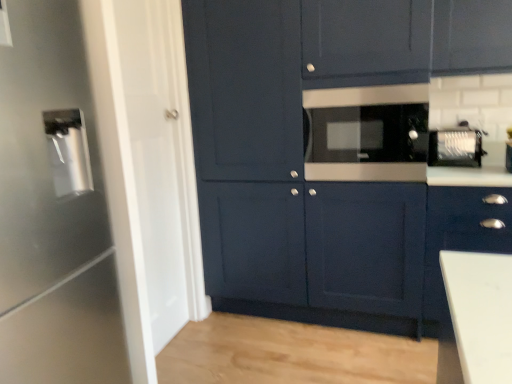
Question: Is satin black microwave at center, the second appliance when ordered from left to right, taller or shorter than satin silver toaster at upper right, the first appliance viewed from the back?

Choices:
 (A) short
 (B) tall

Answer: (B)

Question: From the image's perspective, is satin black microwave at center, the second appliance when ordered from right to left, located above or below satin silver toaster at upper right, the first appliance viewed from the back?

Choices:
 (A) above
 (B) below

Answer: (A)

Question: Which is farther from the matte dark blue cabinet at center, which is counted as the 2th cabinetry, starting from the right?

Choices:
 (A) satin silver toaster at upper right, the first appliance viewed from the back
 (B) matte dark blue cabinet at lower right, acting as the 1th cabinetry starting from the right
 (C) satin black microwave at center, the second appliance from the back
 (D) satin silver water dispenser at left, positioned as the first appliance in left-to-right order

Answer: (D)

Question: Which object is the closest to the matte dark blue cabinet at center, which is counted as the 2th cabinetry, starting from the right?

Choices:
 (A) satin silver water dispenser at left, positioned as the first appliance in left-to-right order
 (B) satin silver toaster at upper right, which ranks as the 3th appliance in left-to-right order
 (C) matte dark blue cabinet at lower right, acting as the 1th cabinetry starting from the right
 (D) satin black microwave at center, the second appliance when ordered from right to left

Answer: (D)